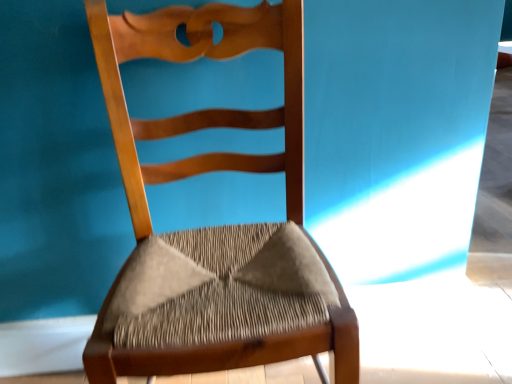
Identify the location of wooden chair at center. [214, 227].

The height and width of the screenshot is (384, 512). What do you see at coordinates (214, 227) in the screenshot? I see `wooden chair at center` at bounding box center [214, 227].

Identify the location of wooden chair at center. The width and height of the screenshot is (512, 384). (214, 227).